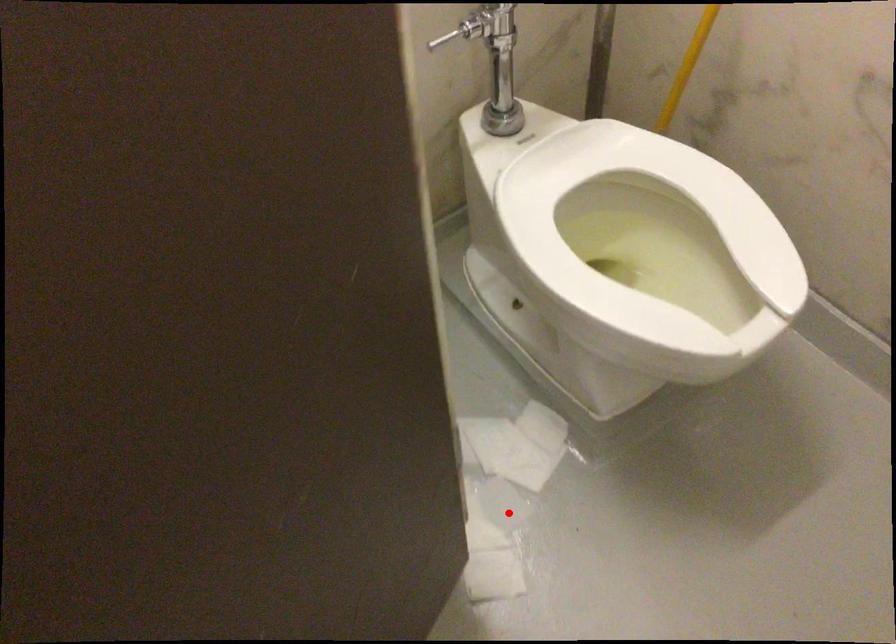
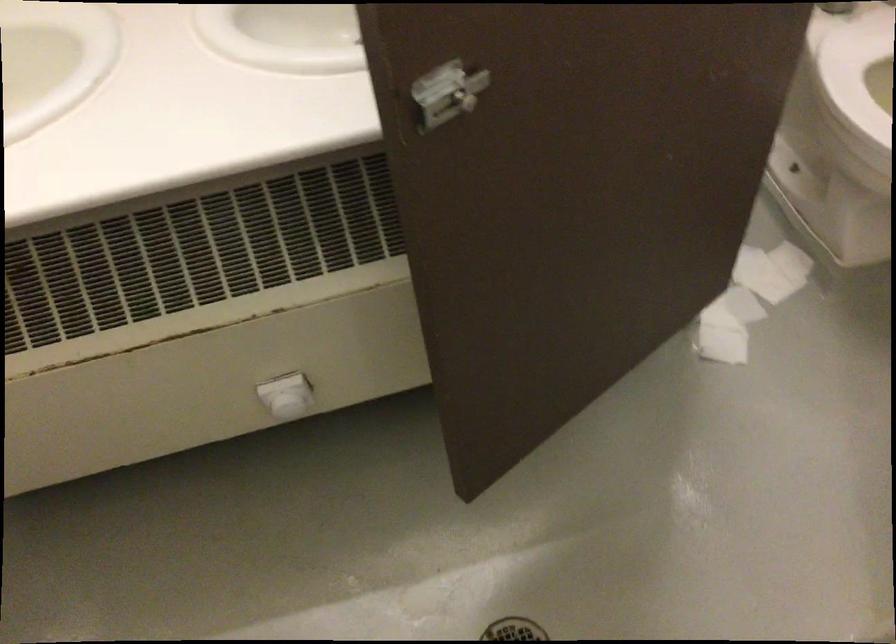
Question: I am providing you with two images of the same scene from different viewpoints. A red point is marked on the first image. Can you still see the location of the red point in image 2?

Choices:
 (A) Yes
 (B) No

Answer: (A)